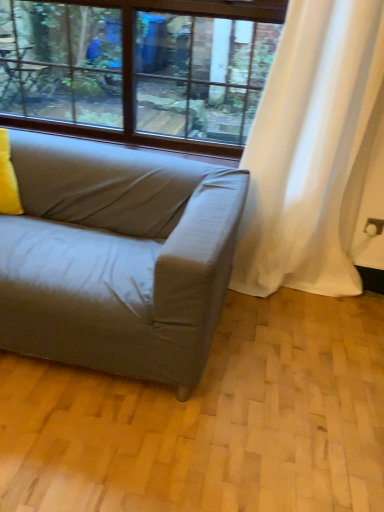
Question: From the image's perspective, relative to white sheer curtain at right, is yellow fabric pillow at left above or below?

Choices:
 (A) above
 (B) below

Answer: (B)

Question: Is yellow fabric pillow at left taller or shorter than white sheer curtain at right?

Choices:
 (A) tall
 (B) short

Answer: (B)

Question: Based on their relative distances, which object is nearer to the yellow fabric pillow at left?

Choices:
 (A) white sheer curtain at right
 (B) matte gray couch at lower left
 (C) clear glass window at upper center

Answer: (B)

Question: Which is nearer to the clear glass window at upper center?

Choices:
 (A) white sheer curtain at right
 (B) matte gray couch at lower left
 (C) yellow fabric pillow at left

Answer: (A)